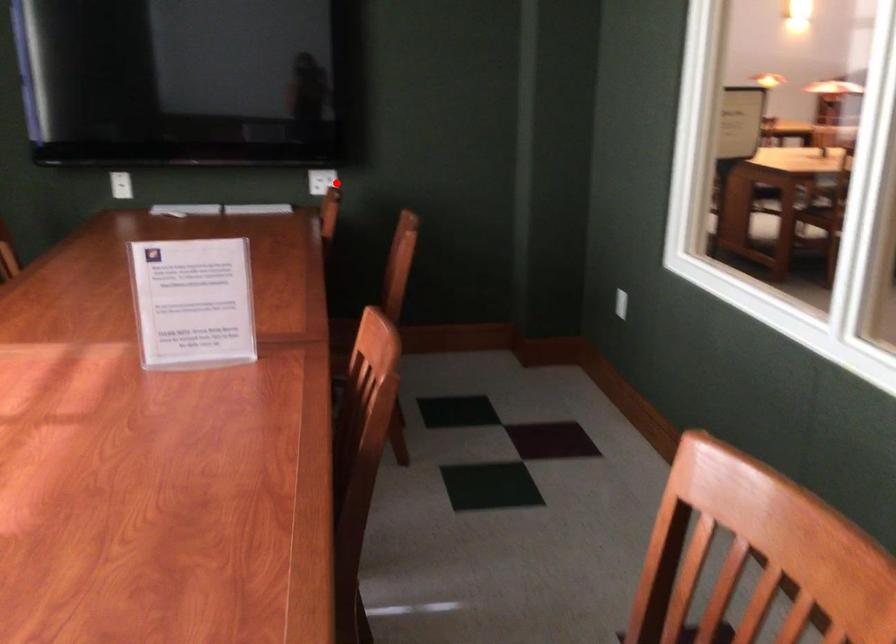
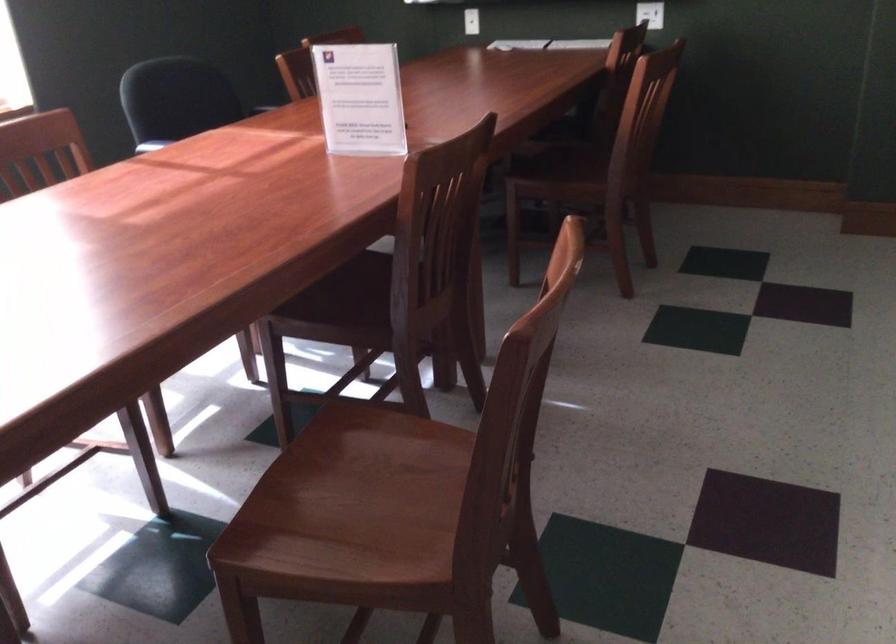
Find the pixel in the second image that matches the highlighted location in the first image.

(650, 14)